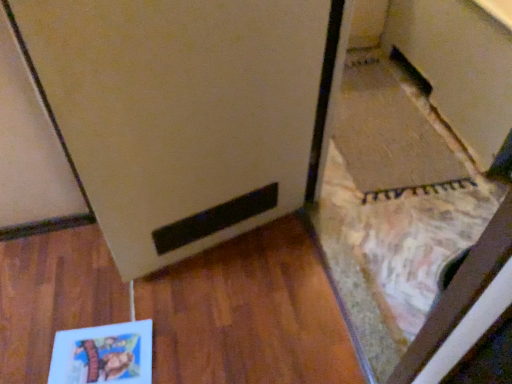
Question: Is matte brown cabinet at lower right positioned far away from matte white fridge at center?

Choices:
 (A) yes
 (B) no

Answer: (A)

Question: From a real-world perspective, is matte brown cabinet at lower right below matte white fridge at center?

Choices:
 (A) no
 (B) yes

Answer: (B)

Question: Is matte brown cabinet at lower right smaller than matte white fridge at center?

Choices:
 (A) no
 (B) yes

Answer: (A)

Question: From the image's perspective, does matte brown cabinet at lower right appear higher than matte white fridge at center?

Choices:
 (A) no
 (B) yes

Answer: (B)

Question: Would you say matte brown cabinet at lower right contains matte white fridge at center?

Choices:
 (A) yes
 (B) no

Answer: (B)

Question: Is the position of matte brown cabinet at lower right more distant than that of matte white fridge at center?

Choices:
 (A) yes
 (B) no

Answer: (A)

Question: Considering the relative sizes of matte paper book at lower left and matte white fridge at center in the image provided, is matte paper book at lower left smaller than matte white fridge at center?

Choices:
 (A) no
 (B) yes

Answer: (B)

Question: Is matte paper book at lower left surrounding matte white fridge at center?

Choices:
 (A) yes
 (B) no

Answer: (B)

Question: From the image's perspective, is matte paper book at lower left under matte white fridge at center?

Choices:
 (A) yes
 (B) no

Answer: (A)

Question: From a real-world perspective, is matte paper book at lower left over matte white fridge at center?

Choices:
 (A) yes
 (B) no

Answer: (B)

Question: From the image's perspective, is matte paper book at lower left over matte white fridge at center?

Choices:
 (A) no
 (B) yes

Answer: (A)

Question: Considering the relative positions of matte paper book at lower left and matte white fridge at center in the image provided, is matte paper book at lower left behind matte white fridge at center?

Choices:
 (A) yes
 (B) no

Answer: (A)

Question: Does matte brown cabinet at lower right lie in front of matte paper book at lower left?

Choices:
 (A) yes
 (B) no

Answer: (B)